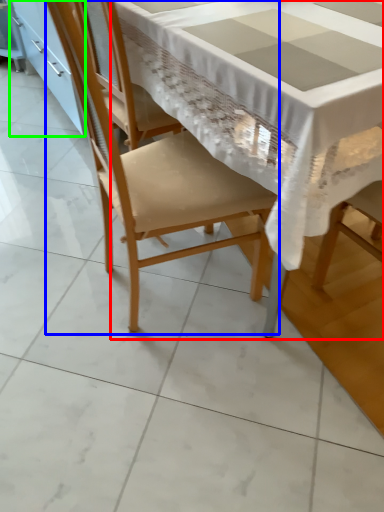
Question: Considering the real-world distances, which object is closest to table (highlighted by a red box)? chair (highlighted by a blue box) or cabinetry (highlighted by a green box).

Choices:
 (A) chair
 (B) cabinetry

Answer: (A)